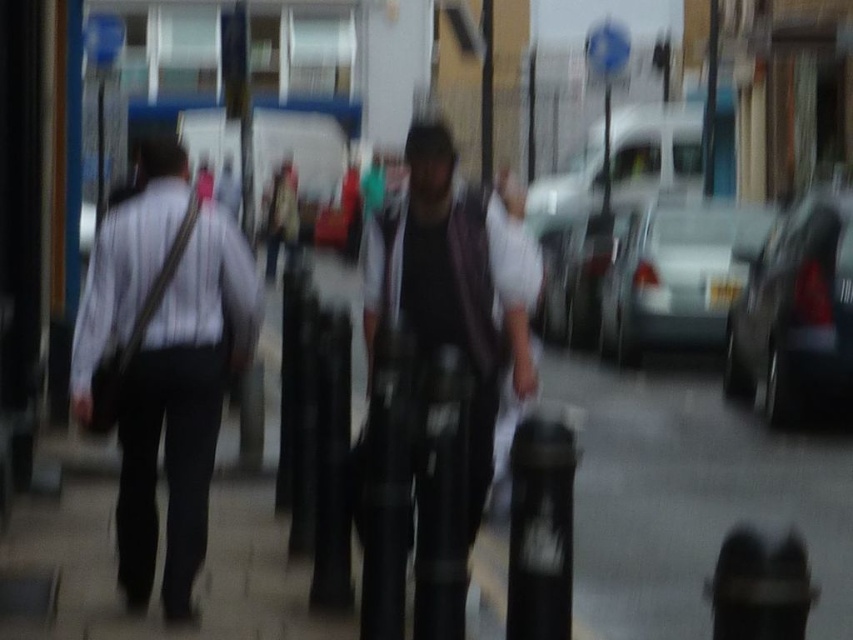
Is shiny black car at right taller than silver metallic sedan at center?

Yes, shiny black car at right is taller than silver metallic sedan at center.

Who is positioned more to the right, shiny black car at right or silver metallic sedan at center?

shiny black car at right

Where is `shiny black car at right`? The width and height of the screenshot is (853, 640). shiny black car at right is located at coordinates (795, 312).

Image resolution: width=853 pixels, height=640 pixels. I want to click on shiny black car at right, so click(795, 312).

Is white striped shirt at left thinner than shiny black car at right?

In fact, white striped shirt at left might be wider than shiny black car at right.

In the scene shown: Can you confirm if white striped shirt at left is wider than shiny black car at right?

Yes, white striped shirt at left is wider than shiny black car at right.

Identify the location of white striped shirt at left. (163, 362).

Who is taller, white striped shirt at left or dark gray fabric jacket at center?

white striped shirt at left

From the picture: Who is more distant from viewer, (201, 481) or (403, 280)?

Point (201, 481)

Where is `white striped shirt at left`? The height and width of the screenshot is (640, 853). white striped shirt at left is located at coordinates (163, 362).